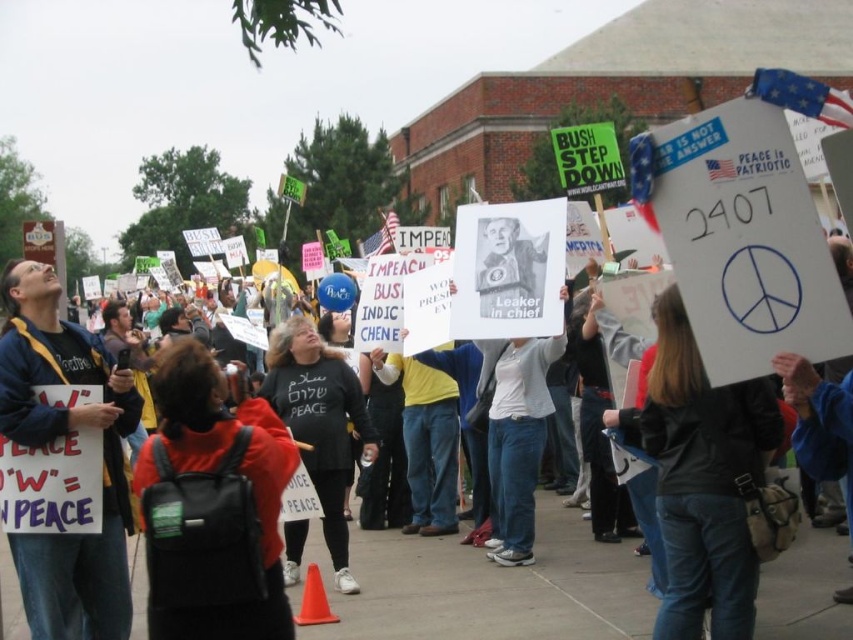
You are a photographer at the protest scene. You want to capture a photo that includes both the black fabric jacket at center and the light gray sweater at center. Which object should you focus on first to ensure both are in the frame?

The black fabric jacket at center is positioned under the light gray sweater at center, so you should focus on the light gray sweater at center first to ensure both are in the frame.